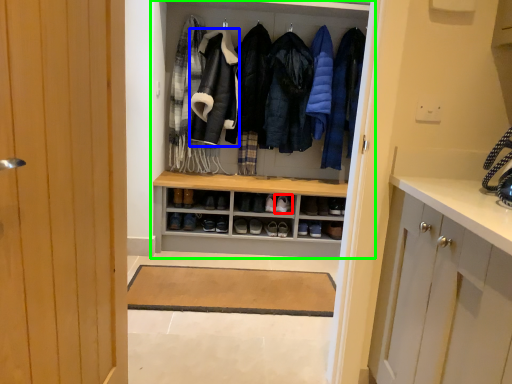
Question: Which object is the closest to the footwear (highlighted by a red box)? Choose among these: garment (highlighted by a blue box) or shelf (highlighted by a green box).

Choices:
 (A) garment
 (B) shelf

Answer: (A)